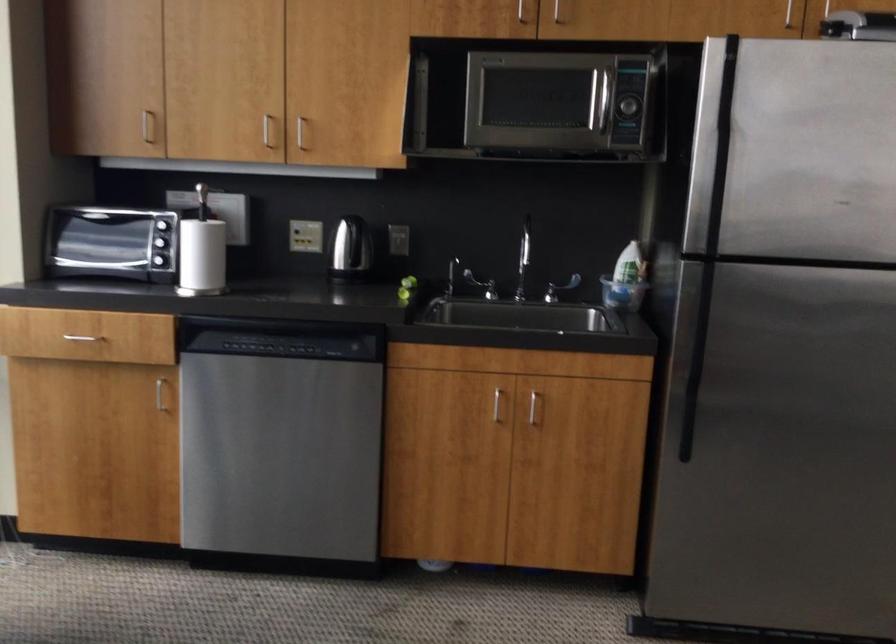
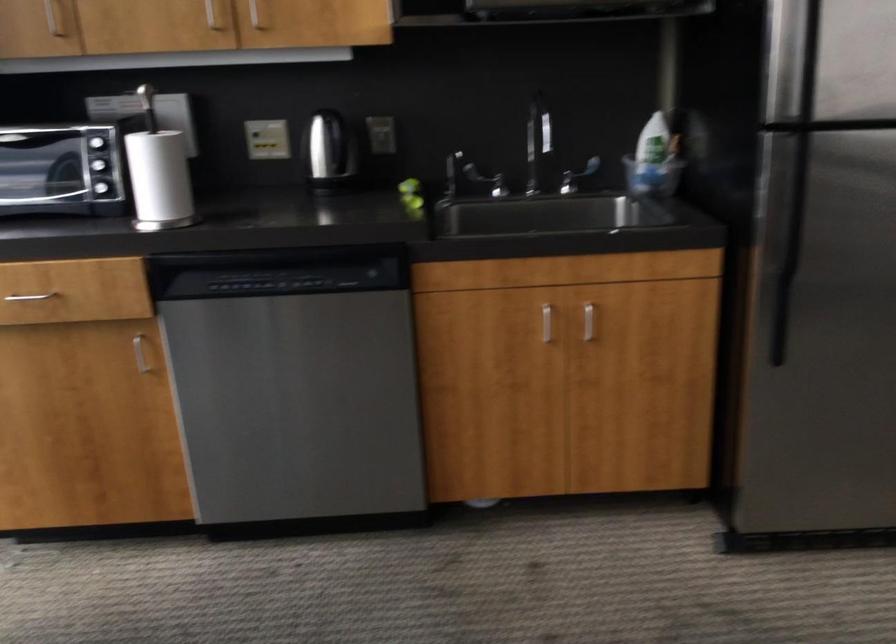
Where in the second image is the point corresponding to point 561,290 from the first image?

(576, 176)